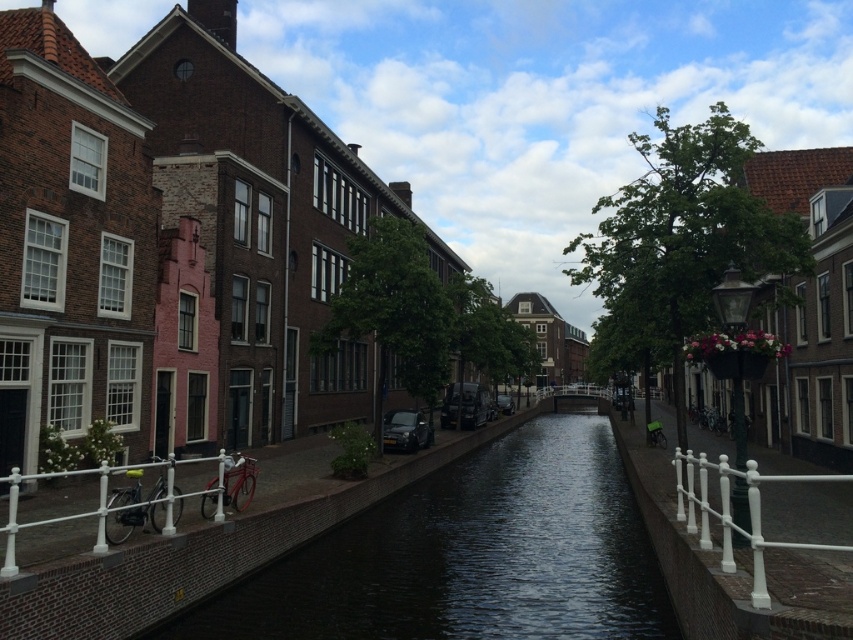
You are standing at the center of the canal scene. Looking towards the lower right corner, can you see the white metal railing at lower right? Please explain your reasoning based on its 2D location.

The white metal railing at lower right is located at point 2D coordinates of (x=732, y=513), which is within the lower right corner of the image. Therefore, yes, you can see the white metal railing at lower right from the center of the canal scene.

You are standing on the canal bridge and want to secure your metallic bicycle at lower left to the white metal railing at lower right. Is the railing located in a position that allows you to attach the bicycle easily?

The white metal railing at lower right is positioned under the metallic bicycle at lower left, so the railing is below the bicycle. To secure the bicycle, you would need to move it downward to the railing.

You are a tourist standing at the edge of the canal, and you want to take a photo of both the white metal railing at lower right and the metallic bicycle at lower left. However, you notice that one of them might be partially hidden by the other. Which object is taller and could potentially block the view of the other in your photo?

The white metal railing at lower right is taller than the metallic bicycle at lower left, so it might block the view of the bicycle if positioned between them.